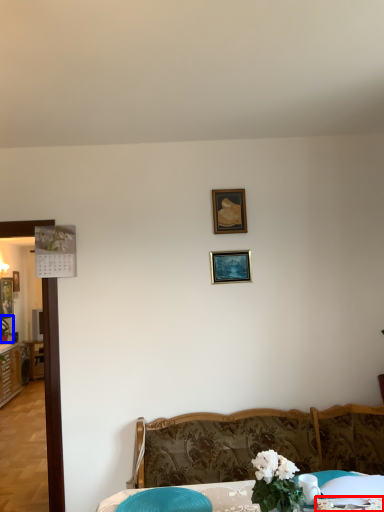
Question: Which object appears closest to the camera in this image, tablecloth (highlighted by a red box) or plant (highlighted by a blue box)?

Choices:
 (A) tablecloth
 (B) plant

Answer: (A)